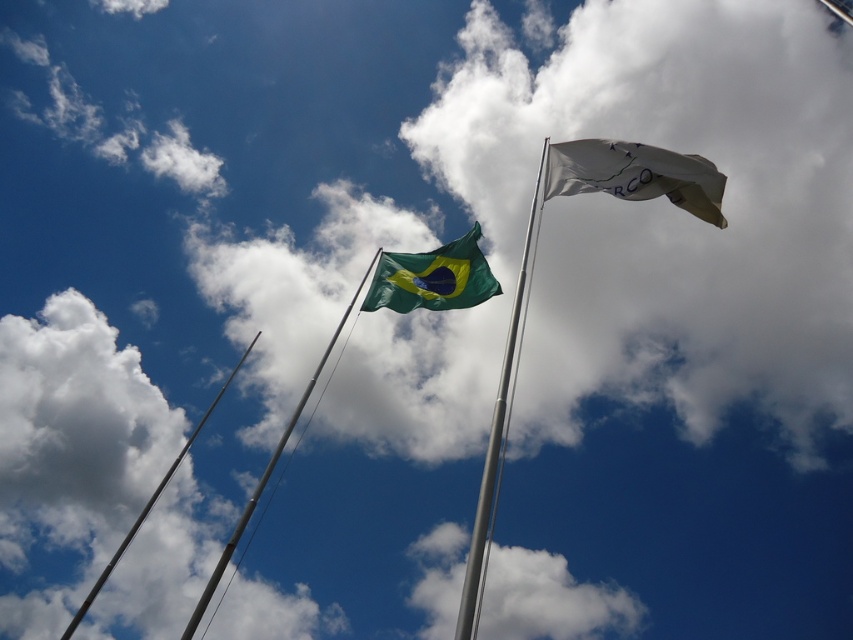
Can you confirm if silver metallic flag pole at center is thinner than metallic silver flag pole at upper center?

Indeed, silver metallic flag pole at center has a lesser width compared to metallic silver flag pole at upper center.

At what (x,y) coordinates should I click in order to perform the action: click on silver metallic flag pole at center. Please return your answer as a coordinate pair (x, y). Looking at the image, I should click on (496, 440).

Where is `silver metallic flag pole at center`? This screenshot has height=640, width=853. silver metallic flag pole at center is located at coordinates (496, 440).

Can you confirm if white fabric flag at upper right is positioned to the right of green fabric flag at center?

Yes, white fabric flag at upper right is to the right of green fabric flag at center.

Can you confirm if white fabric flag at upper right is positioned below green fabric flag at center?

No, white fabric flag at upper right is not below green fabric flag at center.

Image resolution: width=853 pixels, height=640 pixels. In order to click on white fabric flag at upper right in this screenshot , I will do `click(635, 173)`.

Can you confirm if green fabric flag at center is bigger than silver metallic flag pole at center?

Incorrect, green fabric flag at center is not larger than silver metallic flag pole at center.

Which is more to the right, green fabric flag at center or silver metallic flag pole at center?

silver metallic flag pole at center is more to the right.

Where is `green fabric flag at center`? green fabric flag at center is located at coordinates (432, 276).